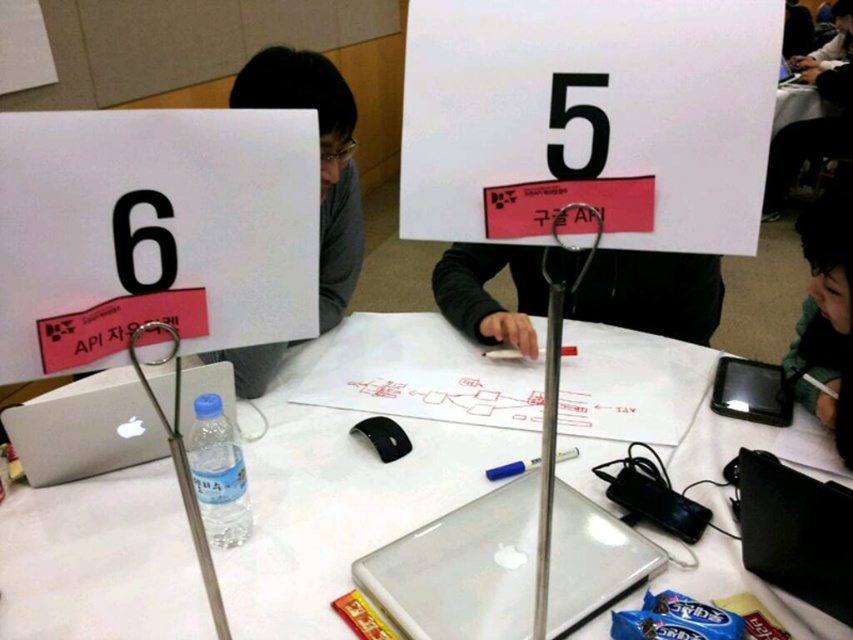
You are a photographer positioned at the back of the room. You need to take a photo of the sleek silver laptop at lower left and the black fabric face at lower right. Which object will appear wider in the photo?

The sleek silver laptop at lower left will appear wider in the photo because its width is larger than the black fabric face at lower right.

You are a participant in this event and need to locate your assigned laptop. According to the scene, where exactly is the sleek silver laptop at lower left positioned?

The sleek silver laptop at lower left is positioned at the 2D coordinates point (85, 428).

You are organizing a workshop and need to place a small note on the table. The note must be placed in an area that is not obstructed by either the sleek silver laptop at lower left or the blue glossy pen at center. Based on their sizes, which object would require more space to avoid covering it?

The sleek silver laptop at lower left is bigger than the blue glossy pen at center, so it would require more space to avoid covering it.